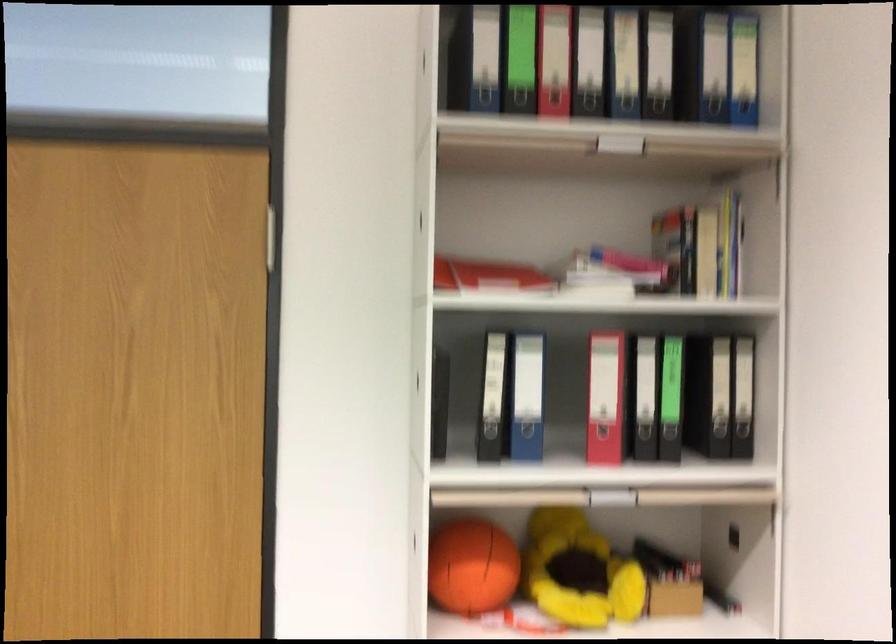
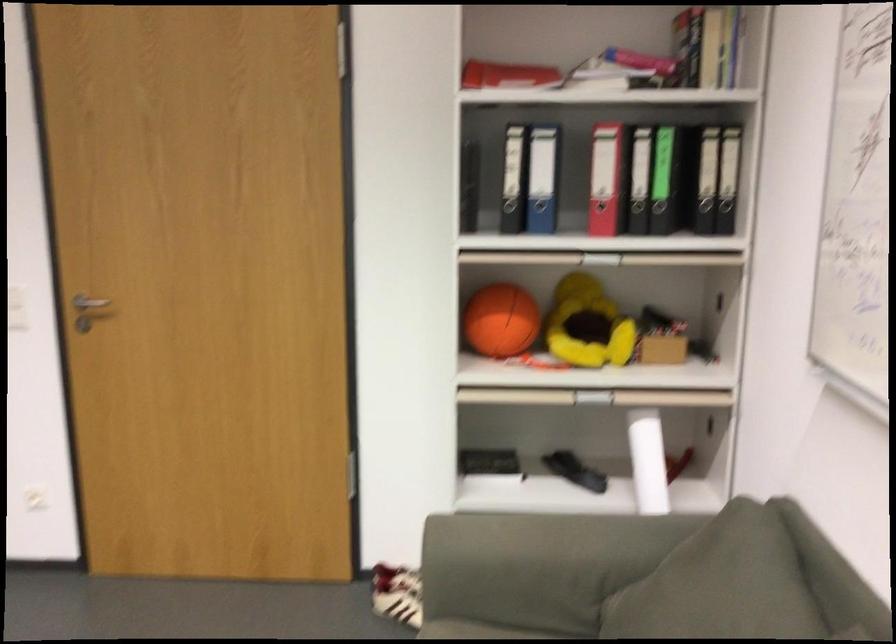
Locate, in the second image, the point that corresponds to the point at 608,399 in the first image.

(606, 178)